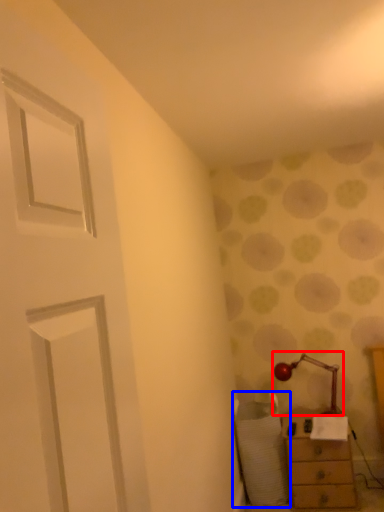
Question: Which of the following is the farthest to the observer, table lamp (highlighted by a red box) or swivel chair (highlighted by a blue box)?

Choices:
 (A) table lamp
 (B) swivel chair

Answer: (A)